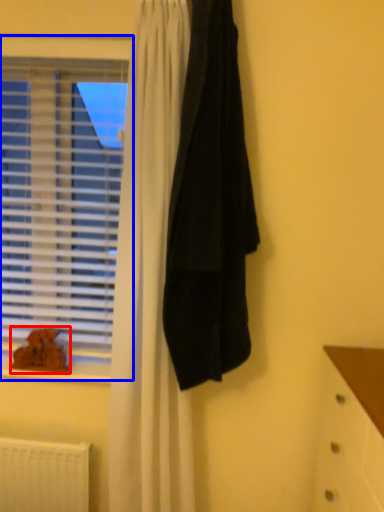
Question: Which of the following is the farthest to the observer, animal (highlighted by a red box) or window (highlighted by a blue box)?

Choices:
 (A) animal
 (B) window

Answer: (A)